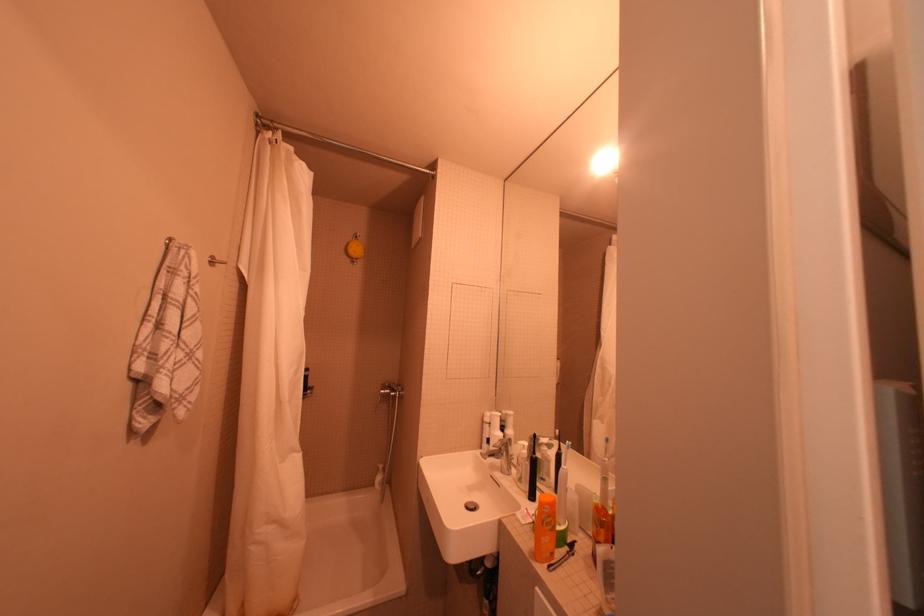
Find where to push the soap dispenser pump. Please return your answer as a coordinate pair (x, y).

(604, 565)